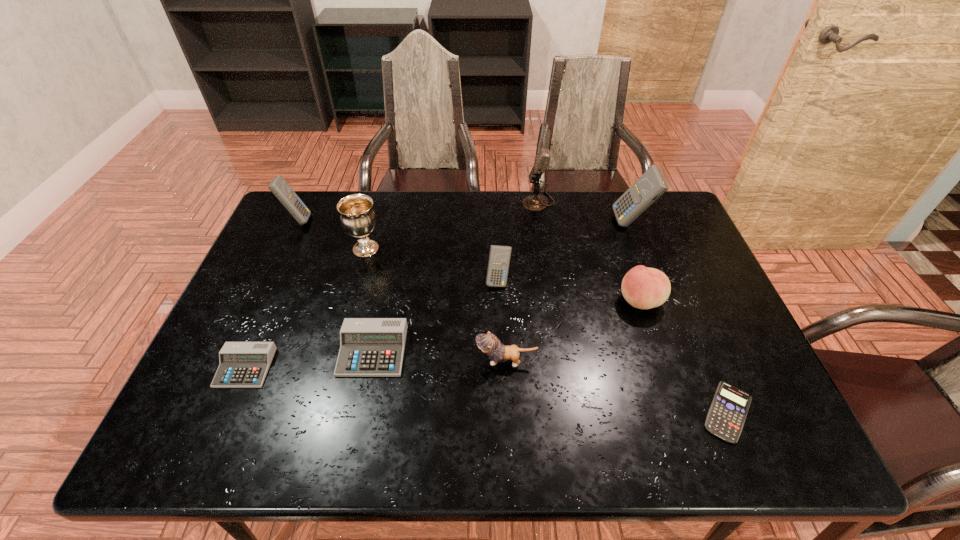
You are a GUI agent. You are given a task and a screenshot of the screen. Output one action in this format:
    pyautogui.click(x=<x>, y=<y>)
    Task: Click on the free space located on the front-facing side of the biggest blue calculator
    This screenshot has height=540, width=960.
    Given the screenshot: What is the action you would take?
    pyautogui.click(x=595, y=222)

This screenshot has height=540, width=960. In order to click on vacant space located on the front-facing side of the biggest blue calculator in this screenshot , I will do `click(555, 222)`.

This screenshot has width=960, height=540. What are the coordinates of `blank area located 0.260m on the left of the chalice` in the screenshot? It's located at (264, 249).

You are a GUI agent. You are given a task and a screenshot of the screen. Output one action in this format:
    pyautogui.click(x=<x>, y=<y>)
    Task: Click on the vacant space located 0.200m on the front-facing side of the second tallest calculator
    This screenshot has width=960, height=540.
    Given the screenshot: What is the action you would take?
    pyautogui.click(x=372, y=220)

The image size is (960, 540). I want to click on vacant area situated 0.260m on the front-facing side of the third farthest blue calculator, so click(x=501, y=370).

You are a GUI agent. You are given a task and a screenshot of the screen. Output one action in this format:
    pyautogui.click(x=<x>, y=<y>)
    Task: Click on the free space located 0.340m on the left of the peach
    The image size is (960, 540).
    Given the screenshot: What is the action you would take?
    pyautogui.click(x=493, y=301)

Locate an element on the screen. free space located on the front-facing side of the kitten is located at coordinates (422, 361).

Locate an element on the screen. Image resolution: width=960 pixels, height=540 pixels. blank space located on the front-facing side of the kitten is located at coordinates (405, 361).

The height and width of the screenshot is (540, 960). I want to click on vacant space located on the front-facing side of the kitten, so click(348, 361).

Locate an element on the screen. Image resolution: width=960 pixels, height=540 pixels. vacant region located 0.120m on the back of the fourth calculator from right to left is located at coordinates (385, 293).